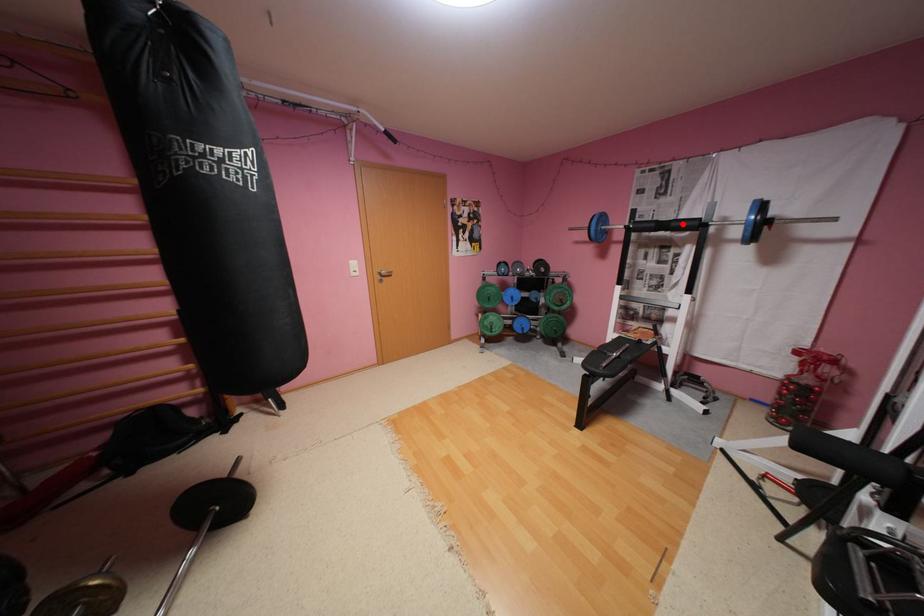
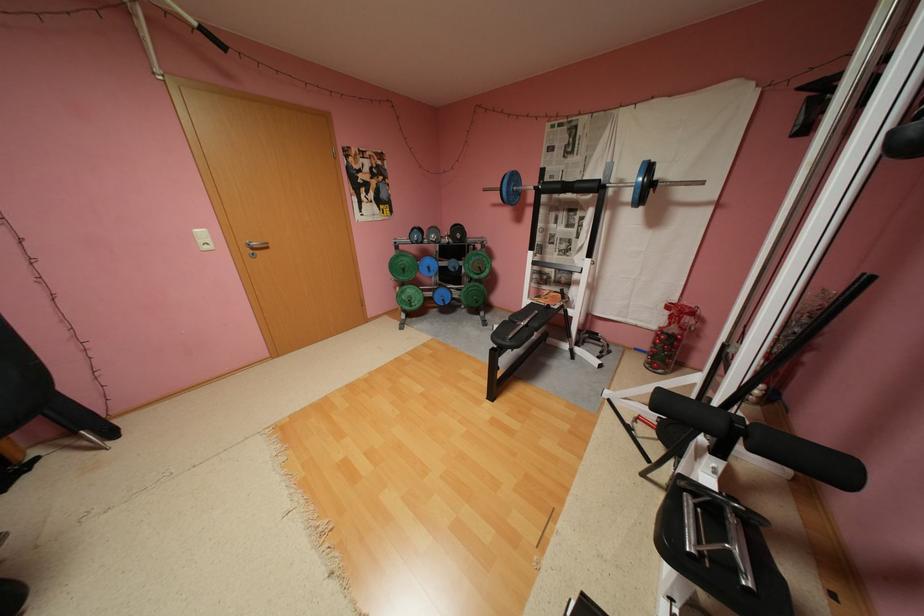
In the second image, find the point that corresponds to the highlighted location in the first image.

(586, 185)